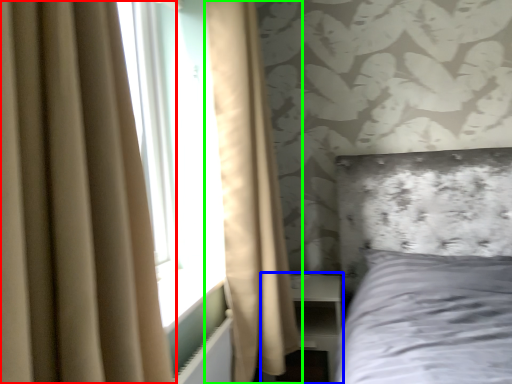
Question: Estimate the real-world distances between objects in this image. Which object is closer to curtain (highlighted by a red box), dresser (highlighted by a blue box) or curtain (highlighted by a green box)?

Choices:
 (A) dresser
 (B) curtain

Answer: (B)